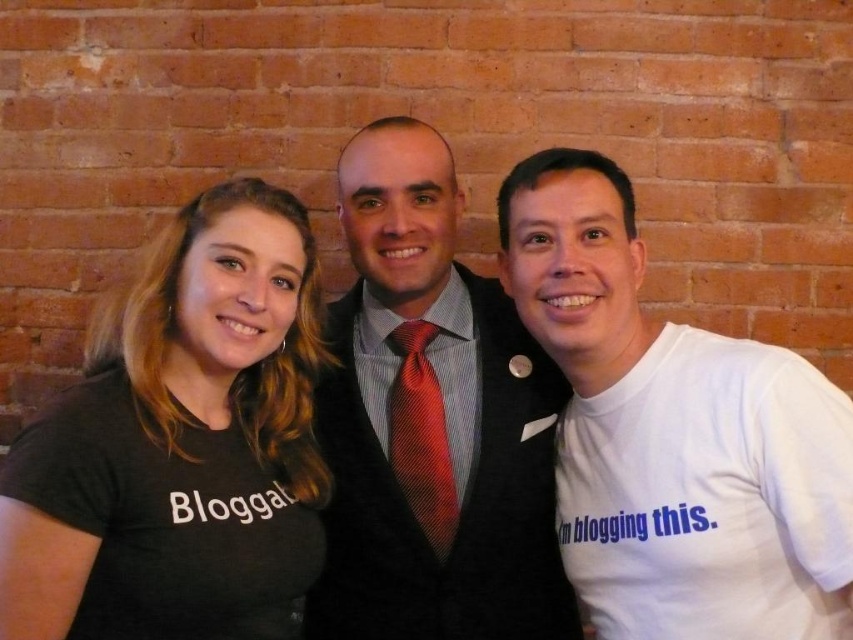
Between point (610, 538) and point (430, 444), which one is positioned behind?

Point (430, 444)

Is white cotton t-shirt at right bigger than red silk tie at center?

Indeed, white cotton t-shirt at right has a larger size compared to red silk tie at center.

Identify the location of white cotton t-shirt at right. (672, 433).

Identify the location of white cotton t-shirt at right. Image resolution: width=853 pixels, height=640 pixels. (672, 433).

Who is positioned more to the left, white cotton t-shirt at right or shiny silk tie at center?

Positioned to the left is shiny silk tie at center.

Does white cotton t-shirt at right appear on the right side of shiny silk tie at center?

Correct, you'll find white cotton t-shirt at right to the right of shiny silk tie at center.

Identify the location of white cotton t-shirt at right. Image resolution: width=853 pixels, height=640 pixels. (672, 433).

Is black t-shirt at left further to the viewer compared to white cotton t-shirt at right?

No, black t-shirt at left is in front of white cotton t-shirt at right.

Can you confirm if black t-shirt at left is positioned to the left of white cotton t-shirt at right?

Correct, you'll find black t-shirt at left to the left of white cotton t-shirt at right.

At what (x,y) coordinates should I click in order to perform the action: click on black t-shirt at left. Please return your answer as a coordinate pair (x, y). This screenshot has height=640, width=853. Looking at the image, I should click on (180, 444).

Locate an element on the screen. The image size is (853, 640). black t-shirt at left is located at coordinates (180, 444).